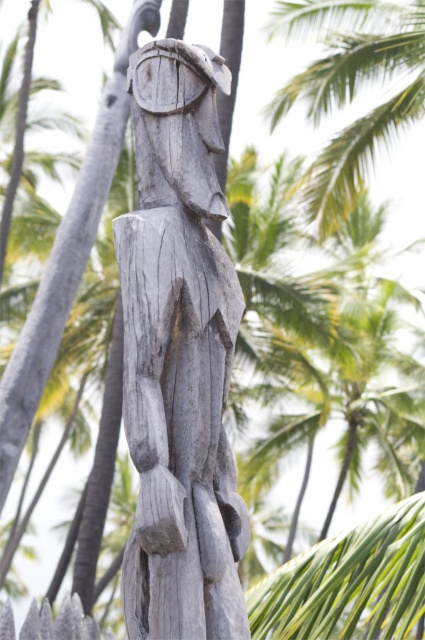
Between point (221, 628) and point (363, 147), which one is positioned in front?

Point (221, 628) is more forward.

Between gray wood carving at center and green leafy palm tree at upper center, which one has less height?

gray wood carving at center

Find the location of a particular element. gray wood carving at center is located at coordinates (178, 356).

This screenshot has width=425, height=640. Find the location of `gray wood carving at center`. gray wood carving at center is located at coordinates (178, 356).